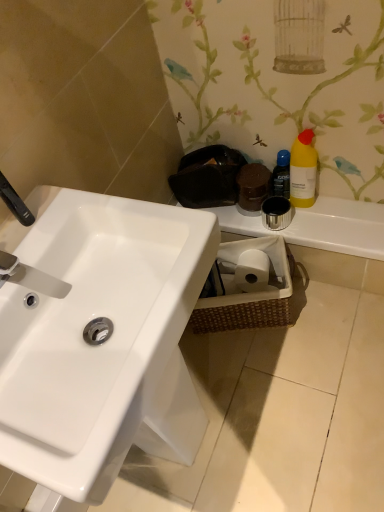
The width and height of the screenshot is (384, 512). In order to click on free spot in front of woven brown basket at lower right in this screenshot , I will do `click(275, 367)`.